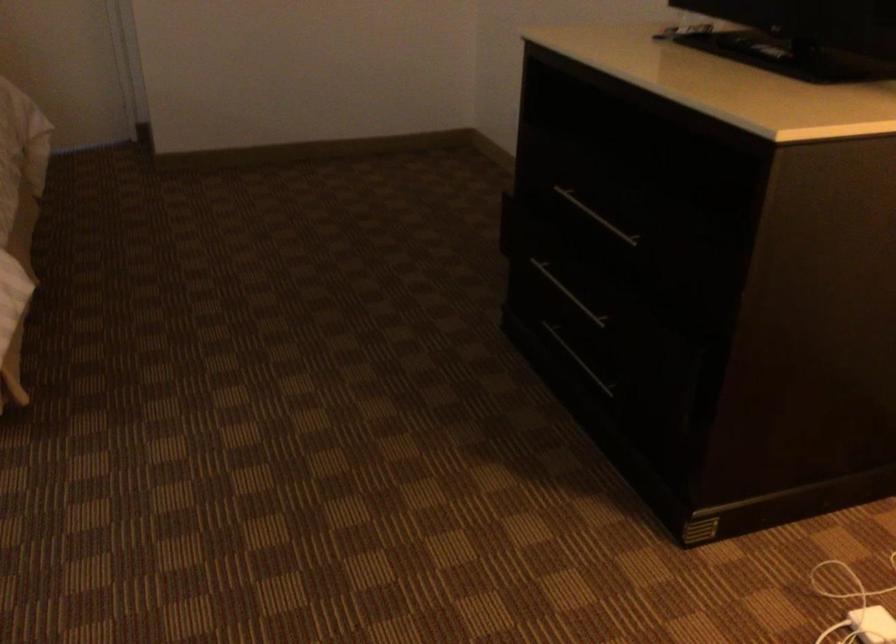
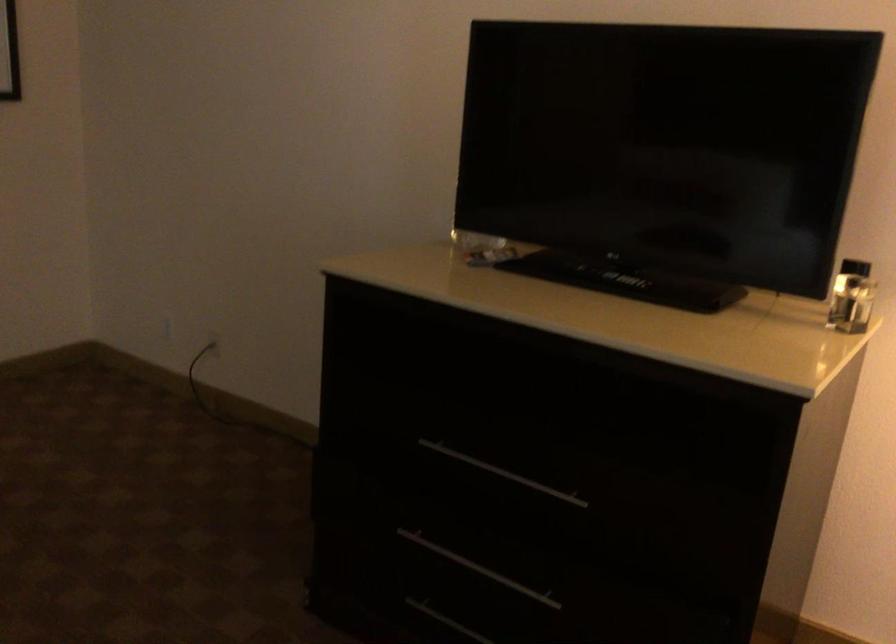
The point at [562,341] is marked in the first image. Where is the corresponding point in the second image?

(446, 621)